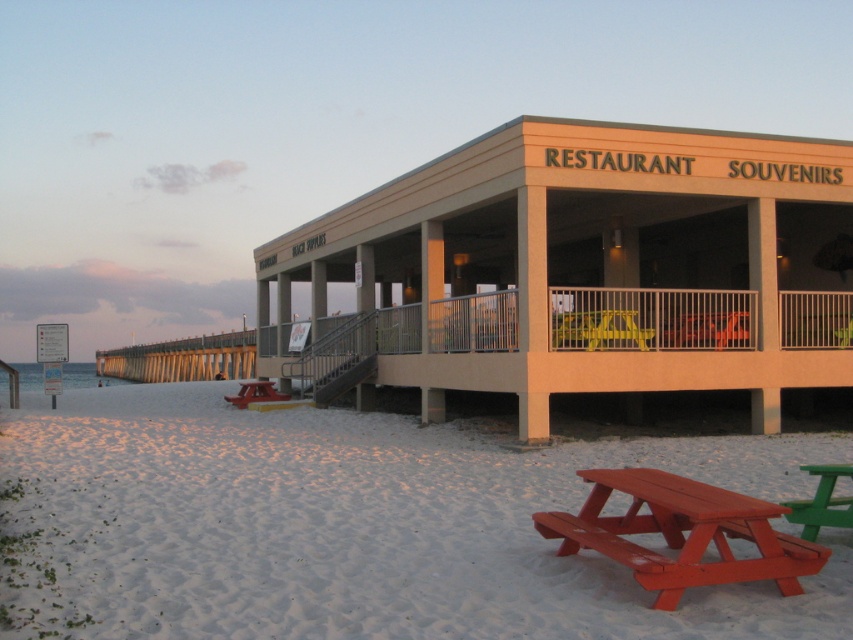
You are standing at the beach and see two points marked on the sand. The first point is at coordinate point (758, 550) and the second is at point (239, 397). If you want to walk towards the first point, which direction should you go relative to the second point?

Since point (758, 550) is in front of point (239, 397), you should walk towards the direction facing away from the second point to reach the first point.